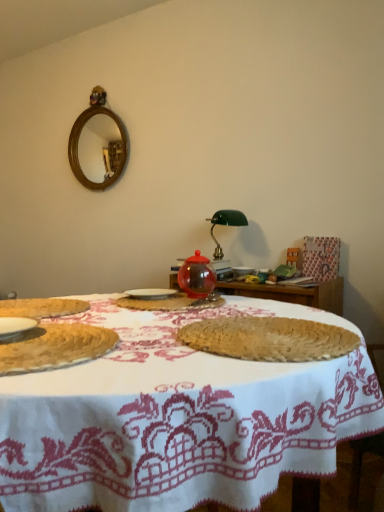
This screenshot has width=384, height=512. Find the location of `free space in front of transparent glass teapot at center`. free space in front of transparent glass teapot at center is located at coordinates (196, 305).